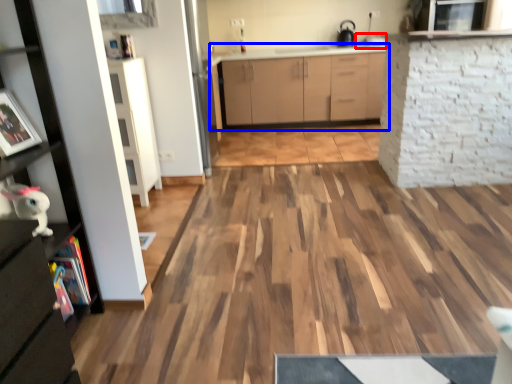
Question: Among these objects, which one is nearest to the camera, sink (highlighted by a red box) or cabinetry (highlighted by a blue box)?

Choices:
 (A) sink
 (B) cabinetry

Answer: (B)